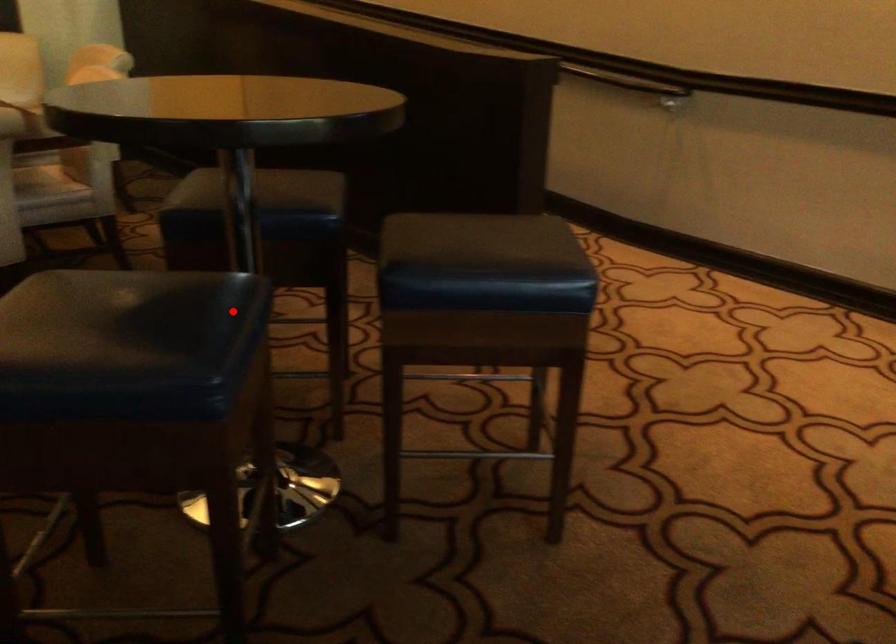
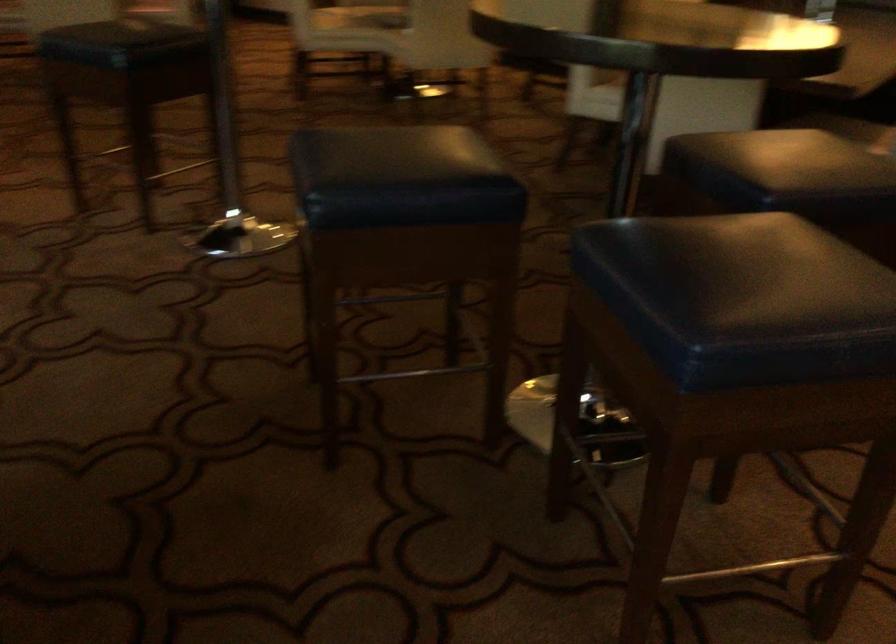
Locate, in the second image, the point that corresponds to the highlighted location in the first image.

(401, 178)